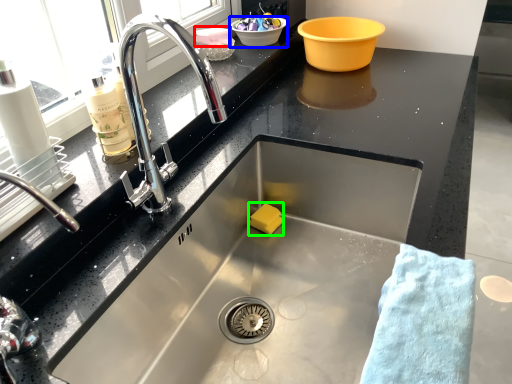
Question: Considering the real-world distances, which object is closest to food (highlighted by a red box)? basin (highlighted by a blue box) or food (highlighted by a green box).

Choices:
 (A) basin
 (B) food

Answer: (A)